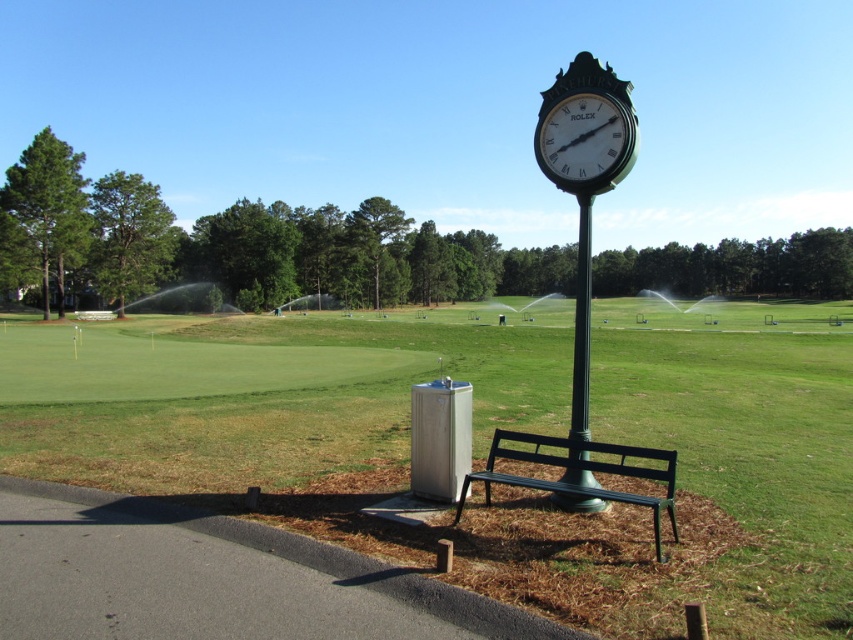
You are standing at the point marked by the coordinates point (x=483, y=445) in the image. What is the name of the object located at that point?

The point (x=483, y=445) corresponds to green grass at center.

You are standing at the golf course and see the green grass at center and the green polished metal pole at center. Which object is located to the left of the other?

The green grass at center is positioned on the left side of green polished metal pole at center, so the green grass at center is to the left of the green polished metal pole at center.